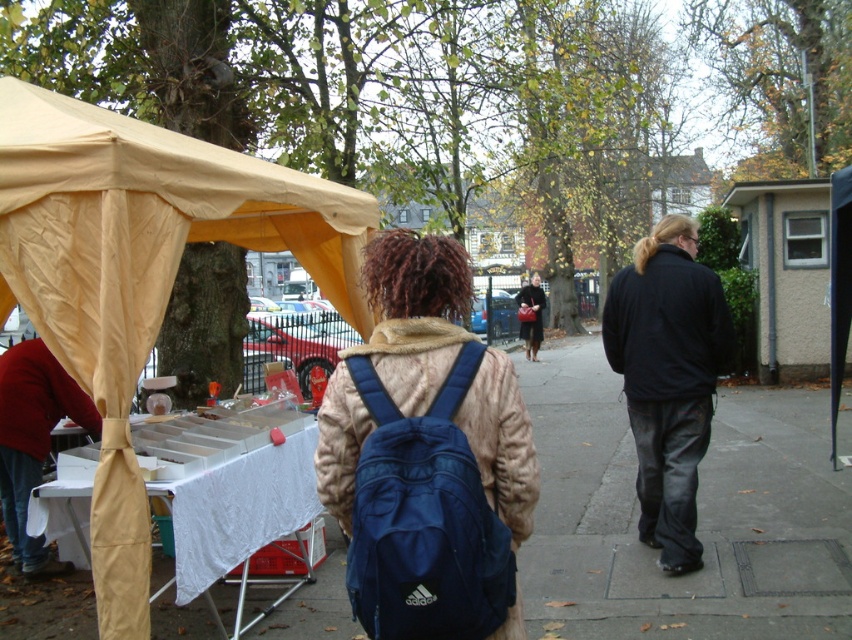
Question: Can you confirm if matte red sweater at left is positioned below matte black coat at center?

Choices:
 (A) yes
 (B) no

Answer: (A)

Question: Can you confirm if matte blue backpack at center is positioned to the left of matte black coat at center?

Choices:
 (A) yes
 (B) no

Answer: (A)

Question: Which point is farther to the camera?

Choices:
 (A) white cloth-covered table at left
 (B) matte red sweater at left
 (C) matte blue backpack at center
 (D) matte black coat at center

Answer: (D)

Question: Considering the relative positions of navy blue fabric backpack at center and black leather jacket at right in the image provided, where is navy blue fabric backpack at center located with respect to black leather jacket at right?

Choices:
 (A) above
 (B) below

Answer: (B)

Question: Which of the following is the farthest from the observer?

Choices:
 (A) matte blue backpack at center
 (B) matte red sweater at left
 (C) beige fabric tent at left
 (D) matte black coat at center

Answer: (D)

Question: Based on their relative distances, which object is nearer to the matte blue backpack at center?

Choices:
 (A) navy blue fabric backpack at center
 (B) matte red sweater at left
 (C) beige fabric tent at left
 (D) white cloth-covered table at left

Answer: (D)